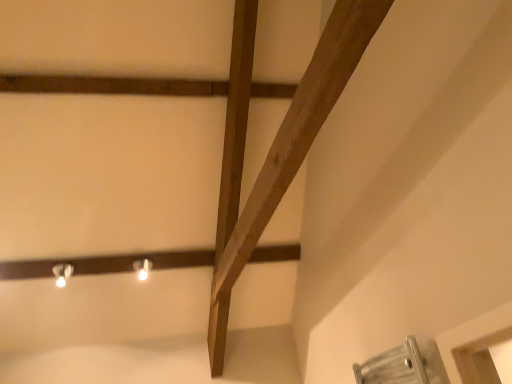
Question: Can you confirm if matte white bulb at upper center, the 1th light fixture from the right, is shorter than white glossy light fixture at upper left, which is the 2th light fixture from right to left?

Choices:
 (A) no
 (B) yes

Answer: (B)

Question: From the image's perspective, is matte white bulb at upper center, the 1th light fixture from the right, under white glossy light fixture at upper left, which is the 2th light fixture from right to left?

Choices:
 (A) no
 (B) yes

Answer: (A)

Question: Can you confirm if matte white bulb at upper center, positioned as the second light fixture in left-to-right order, is positioned to the right of white glossy light fixture at upper left, which is the 2th light fixture from right to left?

Choices:
 (A) yes
 (B) no

Answer: (A)

Question: Is white glossy light fixture at upper left, which is the 2th light fixture from right to left, located within matte white bulb at upper center, positioned as the second light fixture in left-to-right order?

Choices:
 (A) yes
 (B) no

Answer: (B)

Question: Is matte white bulb at upper center, the 1th light fixture from the right, wider than white glossy light fixture at upper left, which is the 2th light fixture from right to left?

Choices:
 (A) no
 (B) yes

Answer: (A)

Question: Is matte white bulb at upper center, positioned as the second light fixture in left-to-right order, completely or partially outside of white glossy light fixture at upper left, the 1th light fixture positioned from the left?

Choices:
 (A) yes
 (B) no

Answer: (A)

Question: Can you confirm if white glossy light fixture at upper left, the 1th light fixture positioned from the left, is taller than matte white bulb at upper center, the 1th light fixture from the right?

Choices:
 (A) no
 (B) yes

Answer: (B)

Question: Does white glossy light fixture at upper left, which is the 2th light fixture from right to left, have a lesser height compared to matte white bulb at upper center, positioned as the second light fixture in left-to-right order?

Choices:
 (A) yes
 (B) no

Answer: (B)

Question: From a real-world perspective, is white glossy light fixture at upper left, the 1th light fixture positioned from the left, below matte white bulb at upper center, positioned as the second light fixture in left-to-right order?

Choices:
 (A) no
 (B) yes

Answer: (A)

Question: Is white glossy light fixture at upper left, which is the 2th light fixture from right to left, facing towards matte white bulb at upper center, the 1th light fixture from the right?

Choices:
 (A) yes
 (B) no

Answer: (B)

Question: Is white glossy light fixture at upper left, the 1th light fixture positioned from the left, not inside matte white bulb at upper center, positioned as the second light fixture in left-to-right order?

Choices:
 (A) no
 (B) yes

Answer: (B)

Question: Is white glossy light fixture at upper left, the 1th light fixture positioned from the left, wider than matte white bulb at upper center, positioned as the second light fixture in left-to-right order?

Choices:
 (A) yes
 (B) no

Answer: (A)

Question: Is matte white bulb at upper center, the 1th light fixture from the right, spatially inside white glossy light fixture at upper left, the 1th light fixture positioned from the left, or outside of it?

Choices:
 (A) inside
 (B) outside

Answer: (B)